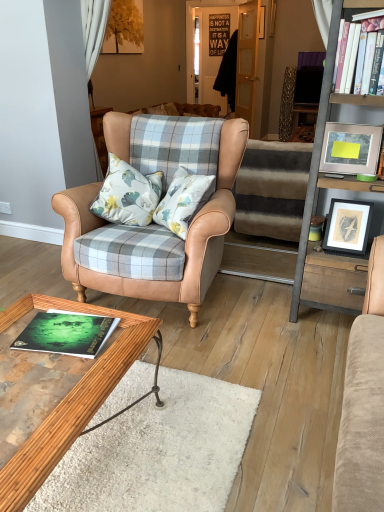
Identify the location of free space above green matte book at lower left, marked as the 1th book in a left-to-right arrangement (from a real-world perspective). This screenshot has height=512, width=384. (74, 327).